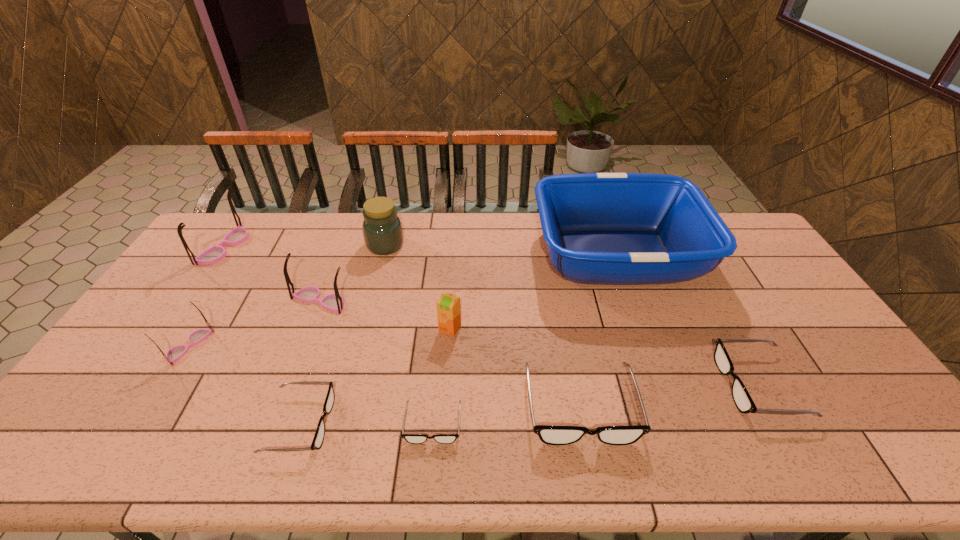
At what (x,y) coordinates should I click in order to perform the action: click on free location located 0.050m on the front of the sixth shortest spectacles. Please return your answer as a coordinate pair (x, y). Looking at the image, I should click on (311, 327).

The width and height of the screenshot is (960, 540). I want to click on free space located 0.090m on the right of the orange juice, so click(492, 329).

At what (x,y) coordinates should I click in order to perform the action: click on free location located 0.320m on the right of the smallest pink spectacles. Please return your answer as a coordinate pair (x, y). Looking at the image, I should click on (320, 346).

I want to click on vacant region located 0.230m on the front-facing side of the second biggest black spectacles, so click(x=636, y=384).

Image resolution: width=960 pixels, height=540 pixels. In order to click on vacant area situated 0.380m on the front-facing side of the second biggest black spectacles in this screenshot , I will do `click(579, 384)`.

You are a GUI agent. You are given a task and a screenshot of the screen. Output one action in this format:
    pyautogui.click(x=<x>, y=<y>)
    Task: Click on the vacant point located 0.380m on the front-facing side of the second biggest black spectacles
    Image resolution: width=960 pixels, height=540 pixels.
    Given the screenshot: What is the action you would take?
    pyautogui.click(x=579, y=384)

The image size is (960, 540). Identify the location of free region located on the front-facing side of the second shortest spectacles. (486, 423).

Identify the location of tray that is at the far edge. Image resolution: width=960 pixels, height=540 pixels. (600, 228).

Find the location of `spectacles that is at the far edge`. spectacles that is at the far edge is located at coordinates (214, 254).

Locate an element on the screen. jar at the far edge is located at coordinates (382, 229).